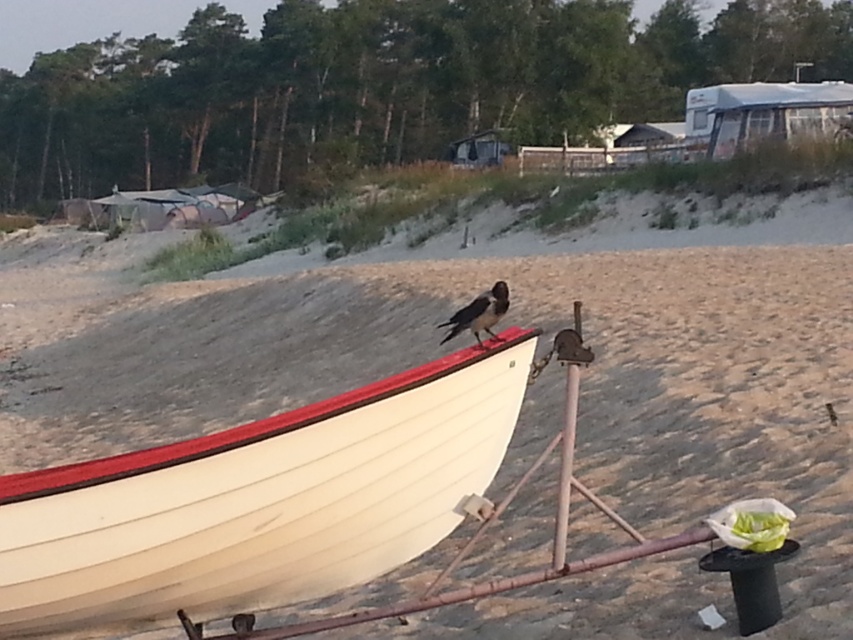
You are standing on the beach and see the white wood boat at center and the black glossy bird at center. Which object is closer to the left side of the beach?

The white wood boat at center is to the left of the black glossy bird at center, so the white wood boat at center is closer to the left side of the beach.

You are standing on the beach and want to take a photo of the white wood boat at center. If you move 0.1 units to the right along the x axis, will you be closer to the boat?

The white wood boat at center is located at point 0.786 on the x axis. Moving 0.1 units to the right would place you at 0.886 on the x axis, which is further away from the boat. Therefore, you will not be closer to the boat.

You are standing at point (259, 502) on the beach. What object is located exactly at your current position?

The white wood boat at center is located exactly at point (259, 502).